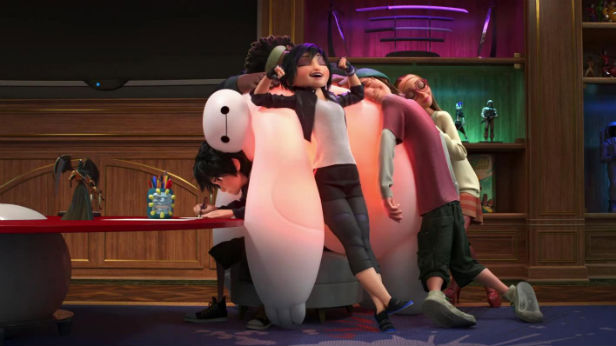
Locate an element on the screen. This screenshot has height=346, width=616. tv is located at coordinates (249, 149), (213, 67).